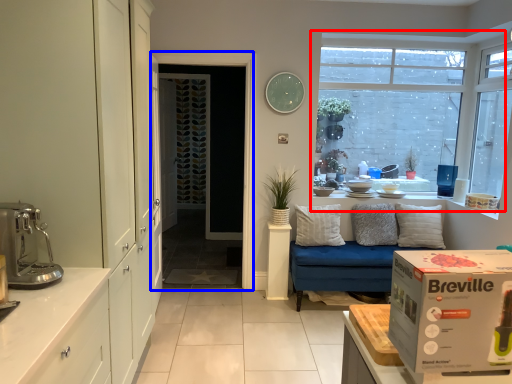
Question: Which of the following is the closest to the observer, window (highlighted by a red box) or screen door (highlighted by a blue box)?

Choices:
 (A) window
 (B) screen door

Answer: (B)